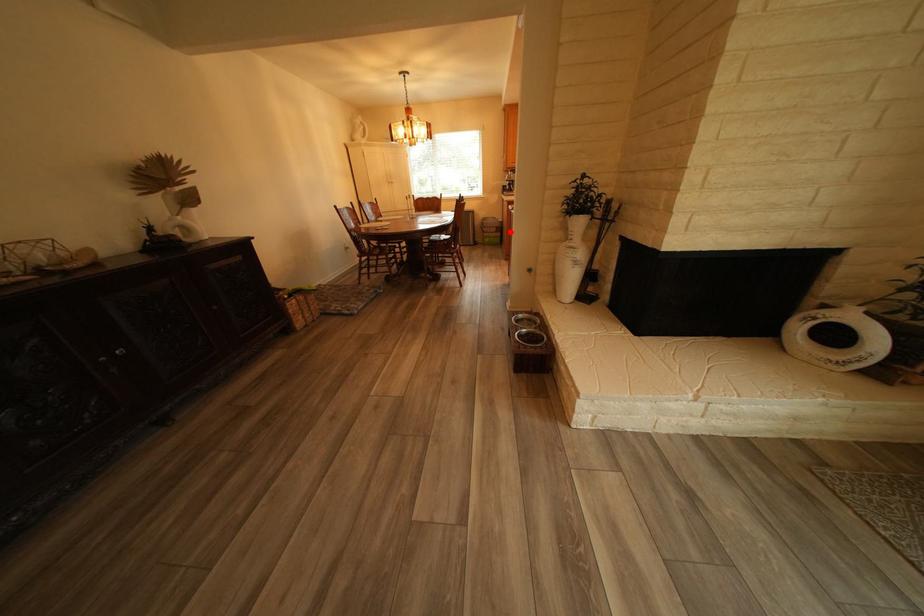
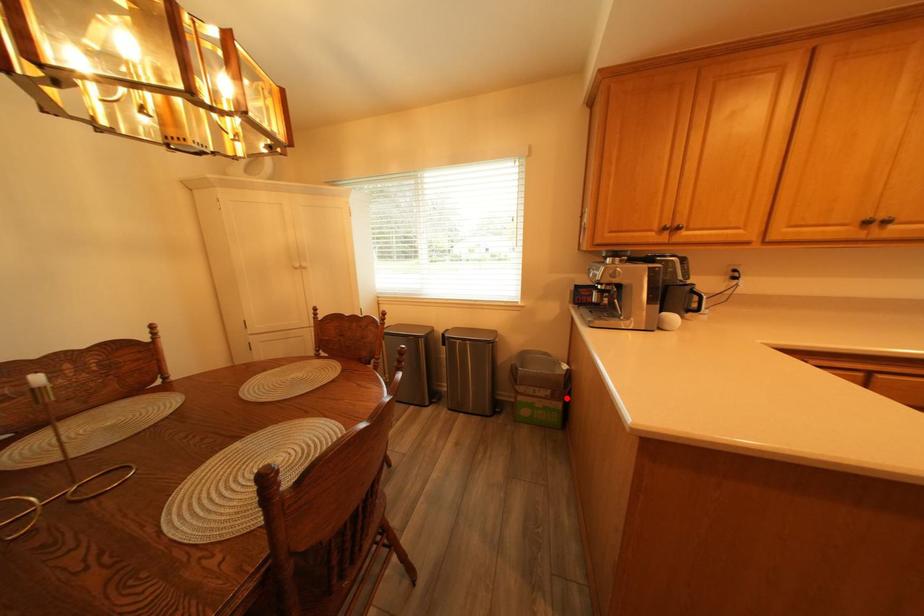
I am providing you with two images of the same scene from different viewpoints. A red point is marked on the first image and another point is marked on the second image. Is the red point in image1 aligned with the point shown in image2?

Yes